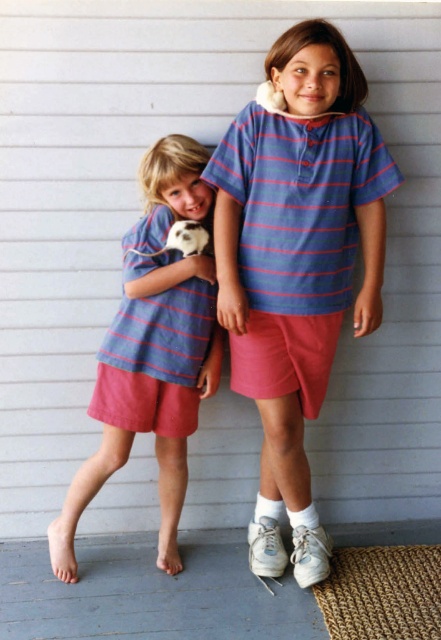
Does point (336, 48) come behind point (159, 440)?

No.

Does blue striped shirt at center have a greater height compared to matte blue striped shirt at left?

Yes, blue striped shirt at center is taller than matte blue striped shirt at left.

Between point (372, 177) and point (109, 451), which one is positioned in front?

Point (372, 177) is in front.

This screenshot has width=441, height=640. What are the coordinates of `blue striped shirt at center` in the screenshot? It's located at (296, 260).